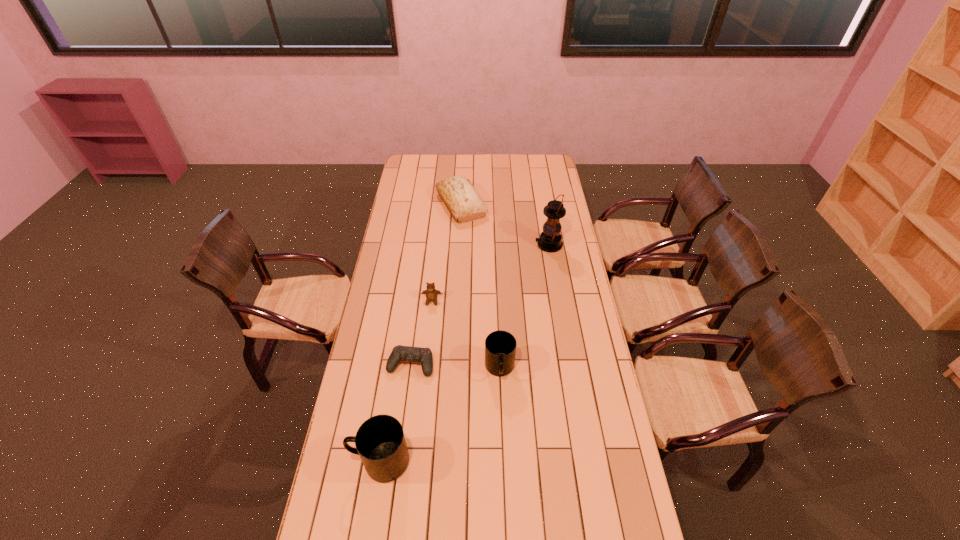
What are the coordinates of `vacant area situated on the side of the farther mug with the handle` in the screenshot? It's located at (504, 491).

What are the coordinates of `free space located 0.130m at the face of the teddy bear` in the screenshot? It's located at (429, 330).

At what (x,y) coordinates should I click in order to perform the action: click on free space located 0.220m on the back of the bread. Please return your answer as a coordinate pair (x, y). This screenshot has height=540, width=960. Looking at the image, I should click on (463, 166).

Find several locations within vacant space located 0.100m above the tallest object, indicating its light source. Please provide its 2D coordinates. Your answer should be formatted as a tuple, i.e. [(x, y)], where the tuple contains the x and y coordinates of a point satisfying the conditions above.

[(515, 245)]

Select a few points in the free space located 0.200m above the tallest object, indicating its light source. Please provide its 2D coordinates. Your answer should be formatted as a tuple, i.e. [(x, y)], where the tuple contains the x and y coordinates of a point satisfying the conditions above.

[(494, 245)]

Identify a few places in vacant region located above the tallest object, indicating its light source. Please provide its 2D coordinates. Your answer should be formatted as a tuple, i.e. [(x, y)], where the tuple contains the x and y coordinates of a point satisfying the conditions above.

[(462, 245)]

This screenshot has height=540, width=960. Identify the location of vacant space located 0.390m on the front of the shortest object. (395, 488).

Where is `mug that is at the left edge`? This screenshot has height=540, width=960. mug that is at the left edge is located at coordinates (380, 442).

Find the location of a particular element. control located in the left edge section of the desktop is located at coordinates (399, 353).

Image resolution: width=960 pixels, height=540 pixels. What are the coordinates of `object present at the right edge` in the screenshot? It's located at (550, 240).